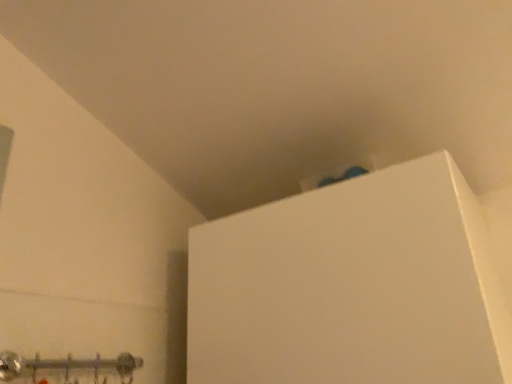
What do you see at coordinates (351, 287) in the screenshot? The height and width of the screenshot is (384, 512). I see `white matte cabinet at upper right` at bounding box center [351, 287].

Image resolution: width=512 pixels, height=384 pixels. I want to click on white matte cabinet at upper right, so click(351, 287).

Measure the distance between white matte cabinet at upper right and camera.

A distance of 23.20 inches exists between white matte cabinet at upper right and camera.

Where is `white matte cabinet at upper right`? This screenshot has height=384, width=512. white matte cabinet at upper right is located at coordinates (351, 287).